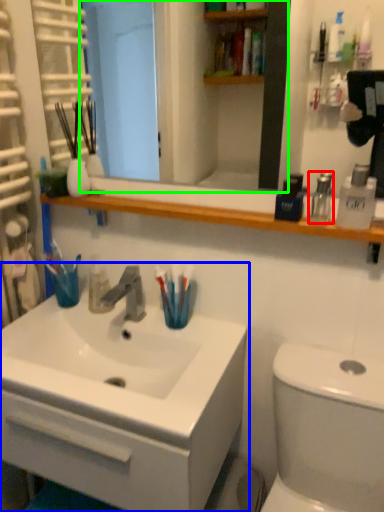
Question: Which object is positioned closest to mouthwash (highlighted by a red box)? Select from bathroom cabinet (highlighted by a blue box) and mirror (highlighted by a green box).

Choices:
 (A) bathroom cabinet
 (B) mirror

Answer: (A)